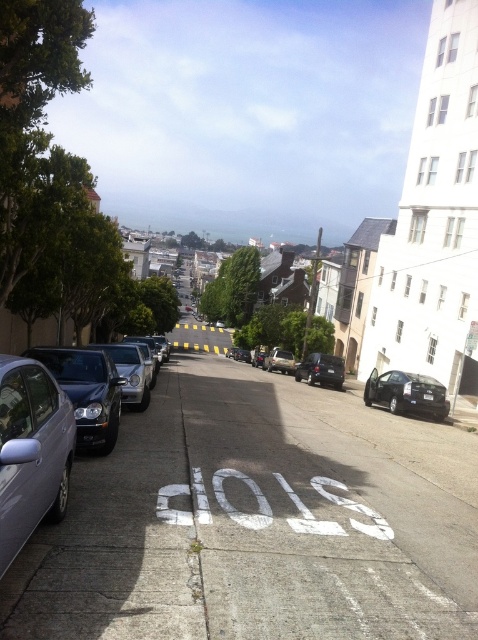
You are driving a car and see the white painted pavement at center and the black matte car at lower right. Which object is closer to the left side of the road?

The white painted pavement at center is to the left of the black matte car at lower right, so it is closer to the left side of the road.